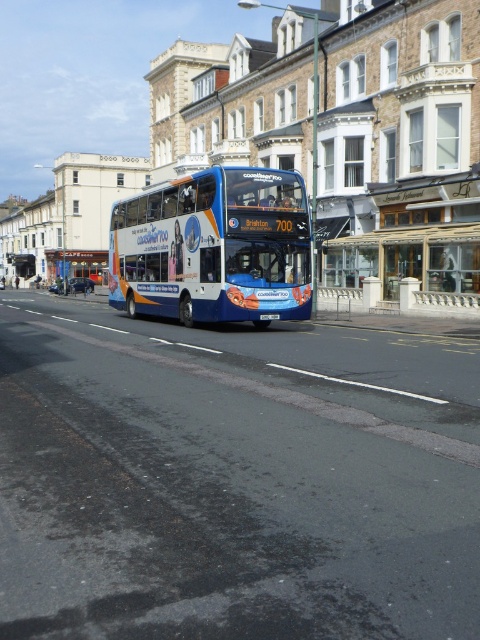
You are a delivery driver who needs to park your truck at the exact coordinates of the blue metallic bus at center. What are the coordinates where you should park your truck?

The blue metallic bus at center is located at coordinates point [214,248], so you should park your truck at those coordinates.

From the picture: You are a pedestrian standing on the sidewalk and want to cross the street where the blue metallic bus at center and the black plastic license plate at center are located. Which object should you look out for first as you begin crossing?

The blue metallic bus at center is to the left of the black plastic license plate at center, so you should look out for the blue metallic bus at center first as it is closer to your left side when crossing.